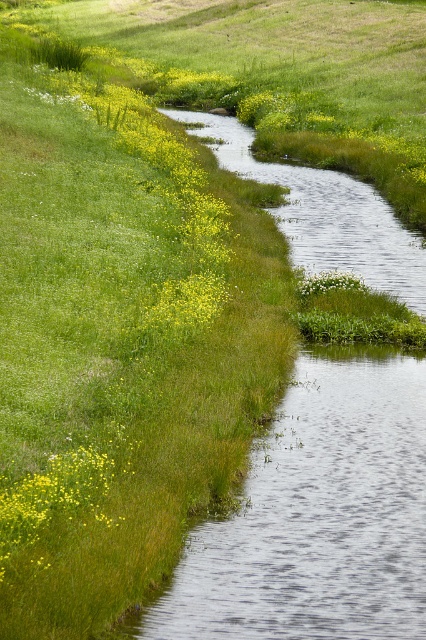
You are standing at the edge of the stream and want to place a small decorative rock at each of the two points labeled point (19, 529) and point (339, 280). Which point will appear larger in your view?

Point (19, 529) is closer to the viewer than point (339, 280), so it will appear larger in your view.